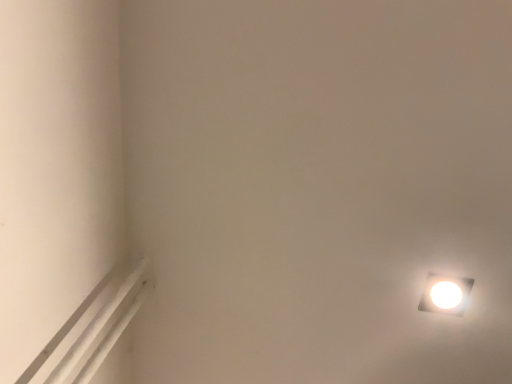
Find the location of `white glossy square lamp at upper right`. white glossy square lamp at upper right is located at coordinates (445, 294).

Describe the element at coordinates (445, 294) in the screenshot. This screenshot has height=384, width=512. I see `white glossy square lamp at upper right` at that location.

Measure the distance between point [448,288] and camera.

Point [448,288] and camera are 34.02 inches apart.

Locate an element on the screen. This screenshot has height=384, width=512. white glossy square lamp at upper right is located at coordinates (445, 294).